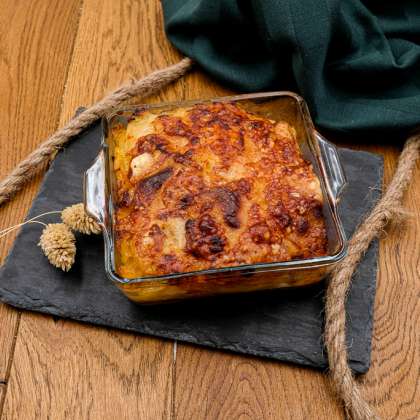
Where is `baking dish`? Image resolution: width=420 pixels, height=420 pixels. baking dish is located at coordinates (272, 278).